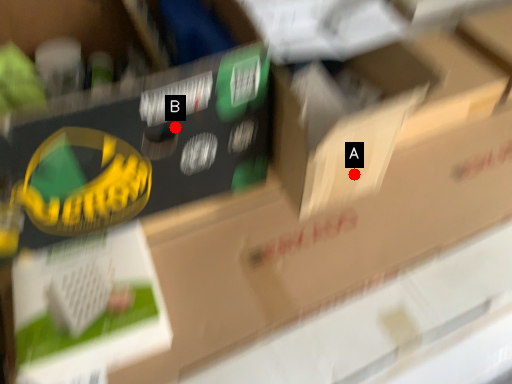
Question: Two points are circled on the image, labeled by A and B beside each circle. Which point is closer to the camera?

Choices:
 (A) A is closer
 (B) B is closer

Answer: (B)